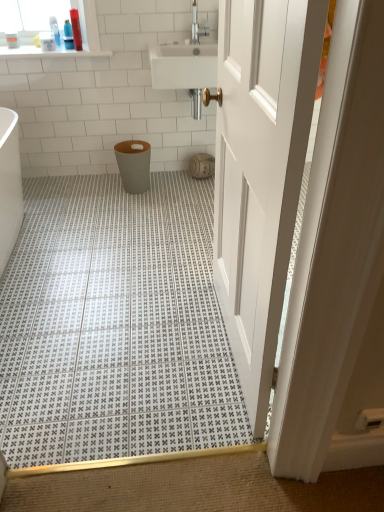
Where is `vacant area situated to the left side of white plastic bottle at upper left, acting as the 3th toiletry starting from the right`? Image resolution: width=384 pixels, height=512 pixels. vacant area situated to the left side of white plastic bottle at upper left, acting as the 3th toiletry starting from the right is located at coordinates (35, 47).